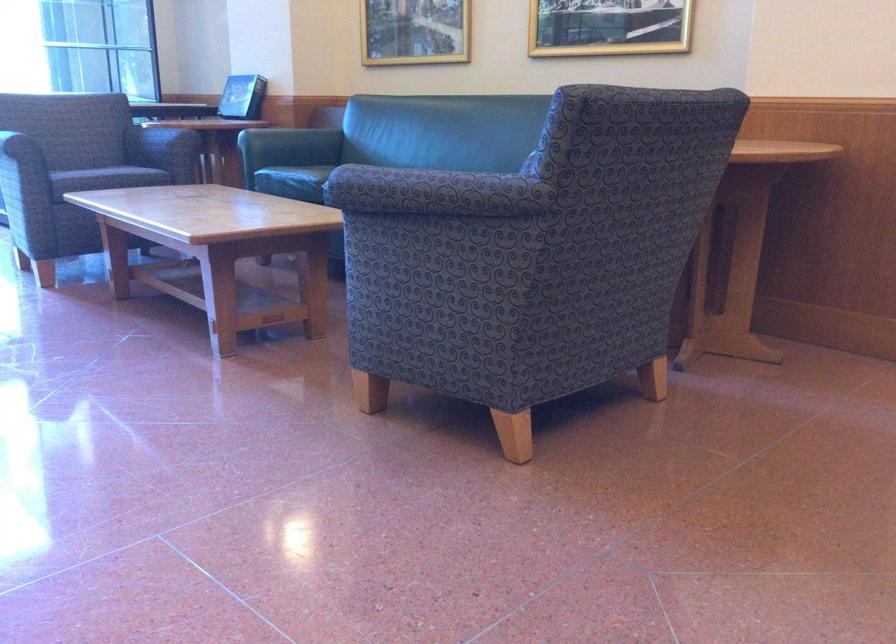
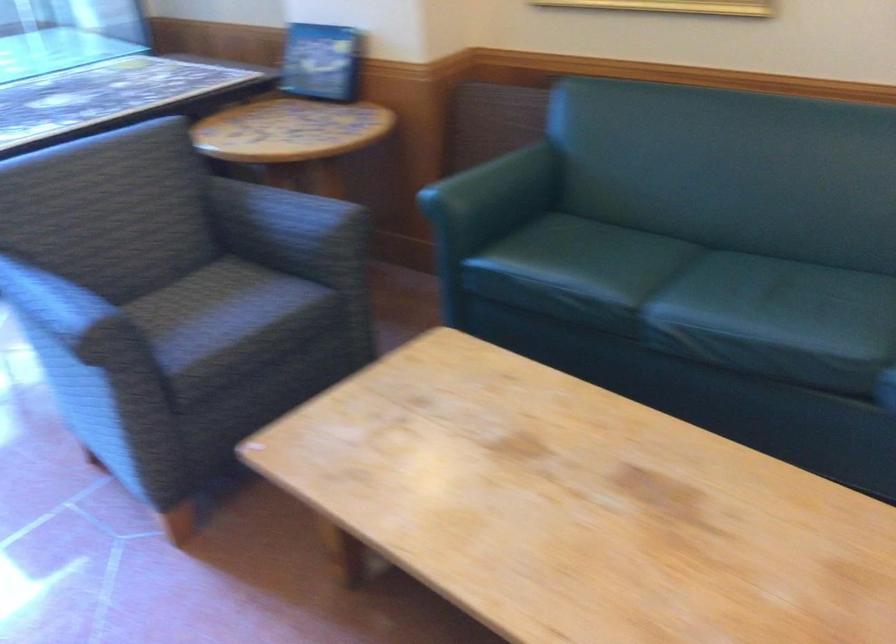
Which direction would the cameraman need to move to produce the second image?

The movement direction of the cameraman is left, forward.